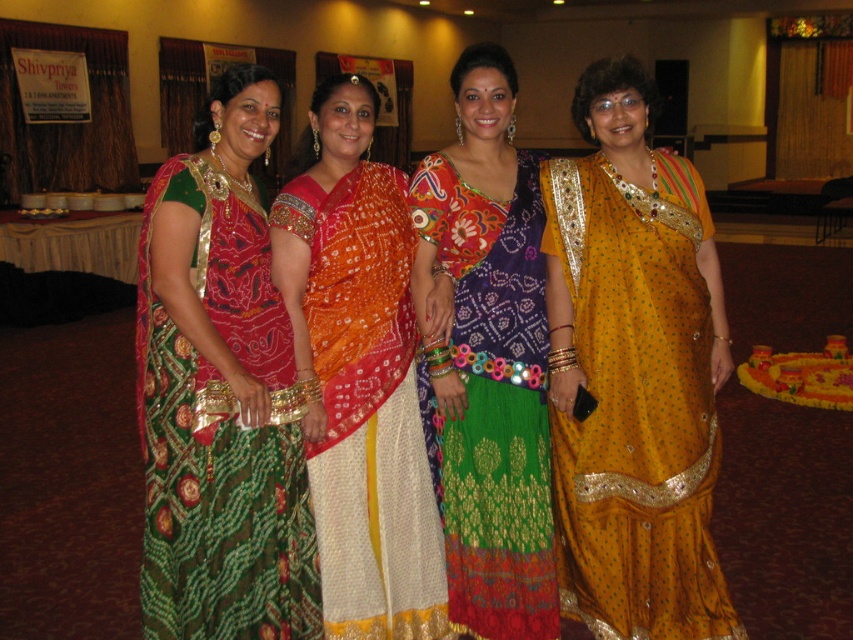
Based on the scene description, which object is placed below the other between the golden silk saree at center and the multicolored embroidered sari at center?

The golden silk saree at center is positioned under the multicolored embroidered sari at center.

Based on the scene description, which of the two center saris, the golden silk saree at center or the orange bandhani sari at center, is positioned higher?

The golden silk saree at center is positioned higher than the orange bandhani sari at center according to the description.

You are a photographer setting up for a group photo. You need to ensure that all sari details are visible. Given that the orange bandhani sari at center and the multicolored embroidered sari at center are both at the center, which sari might require you to adjust your camera angle to capture its full length?

The orange bandhani sari at center has a lesser height compared to the multicolored embroidered sari at center, so you might need to adjust the camera angle to ensure the shorter orange bandhani sari at center is fully visible alongside the taller one.